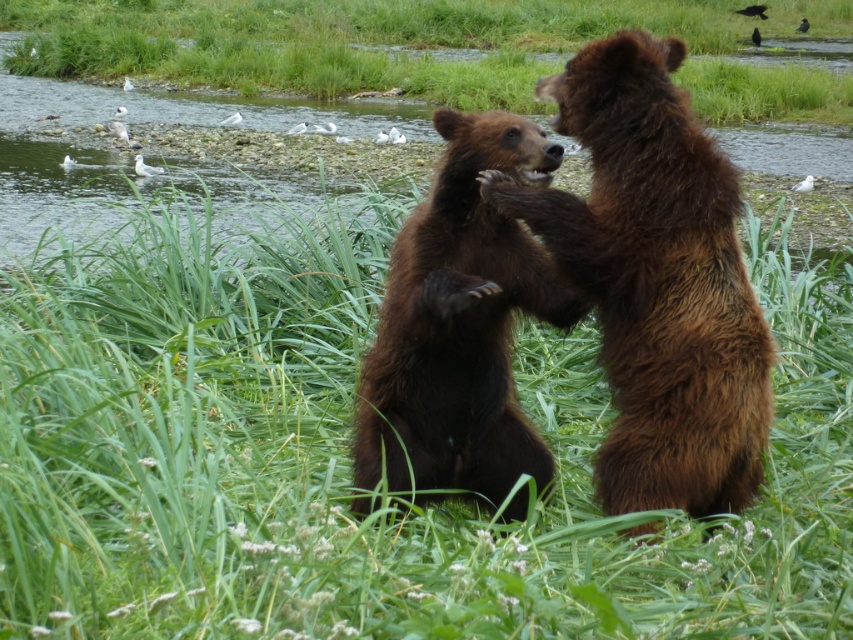
Question: Based on their relative distances, which object is nearer to the brown furry bear at center?

Choices:
 (A) green grassy at center
 (B) brown fuzzy bear at center

Answer: (B)

Question: Which of the following is the farthest from the observer?

Choices:
 (A) green grassy at center
 (B) brown furry bear at center
 (C) brown fuzzy bear at center

Answer: (C)

Question: Does brown fuzzy bear at center appear on the right side of brown furry bear at center?

Choices:
 (A) no
 (B) yes

Answer: (B)

Question: Is green grassy at center positioned behind brown furry bear at center?

Choices:
 (A) no
 (B) yes

Answer: (A)

Question: Which point is closer to the camera?

Choices:
 (A) brown fuzzy bear at center
 (B) brown furry bear at center

Answer: (B)

Question: Does green grassy at center have a larger size compared to brown furry bear at center?

Choices:
 (A) yes
 (B) no

Answer: (A)